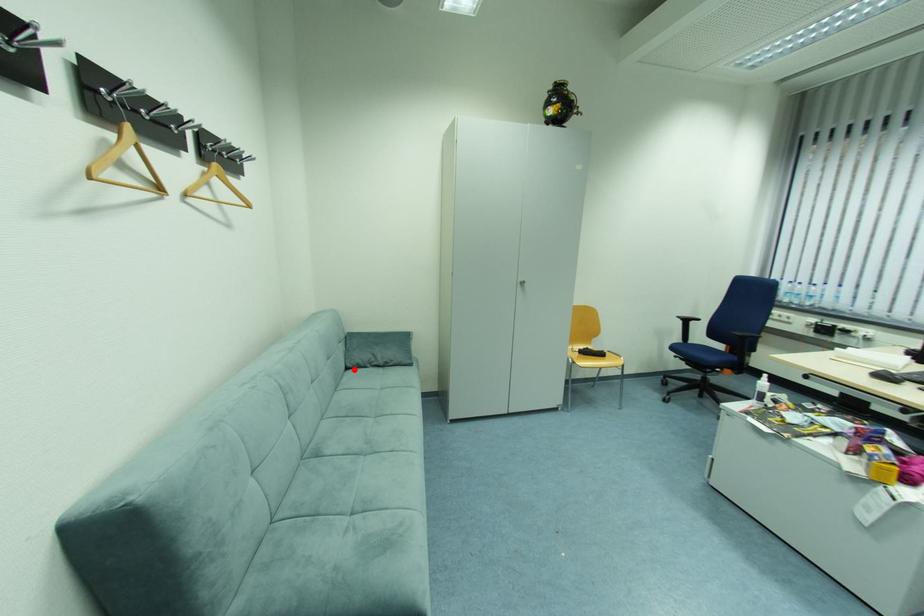
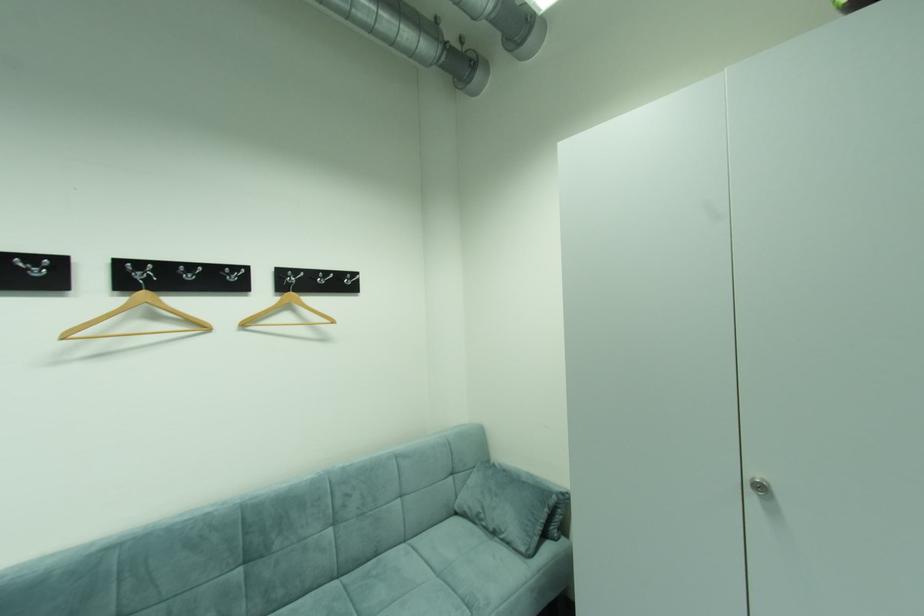
Where in the second image is the point corresponding to the highlighted location from the first image?

(464, 514)